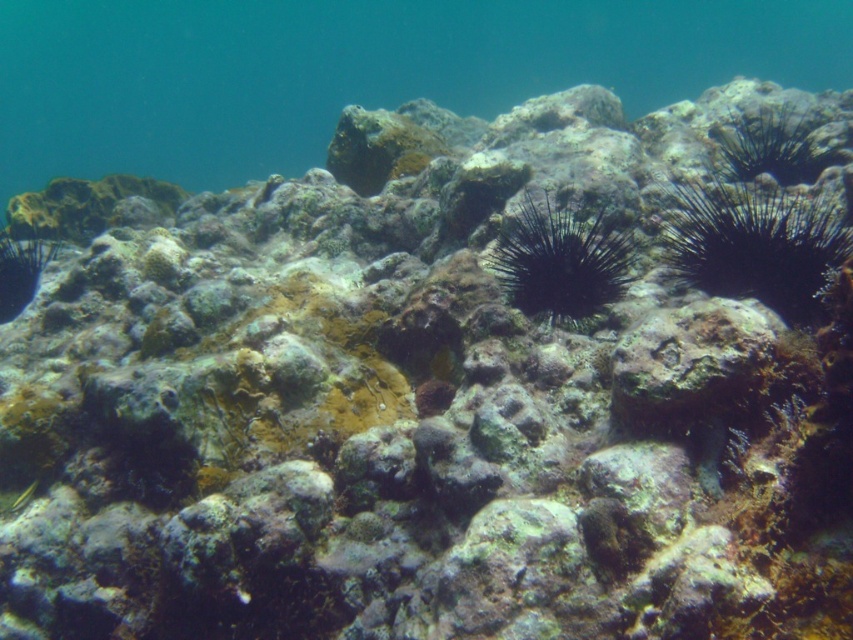
Question: Does black spiny sea urchin at right have a lesser width compared to black spiny sea urchin at center?

Choices:
 (A) no
 (B) yes

Answer: (A)

Question: In this image, where is black spiny sea urchin at right located relative to black spiny sea urchin at center?

Choices:
 (A) right
 (B) left

Answer: (A)

Question: Which of the following is the farthest from the observer?

Choices:
 (A) (670, 204)
 (B) (639, 243)

Answer: (A)

Question: Which of the following is the closest to the observer?

Choices:
 (A) black spiny sea urchin at right
 (B) black spiny sea urchin at center

Answer: (A)

Question: Can you confirm if black spiny sea urchin at right is bigger than black spiny sea urchin at center?

Choices:
 (A) no
 (B) yes

Answer: (B)

Question: Which of the following is the closest to the observer?

Choices:
 (A) (563, 305)
 (B) (805, 224)

Answer: (A)